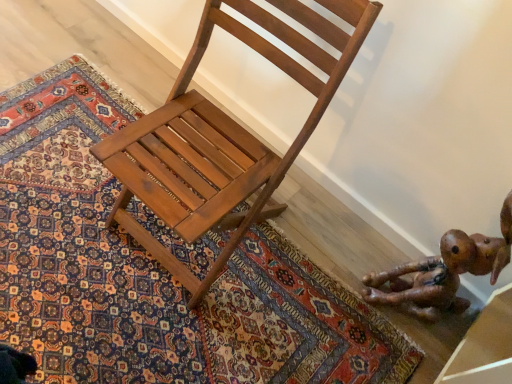
Where is `free space that is to the left of brown leather toy at lower right`? This screenshot has width=512, height=384. free space that is to the left of brown leather toy at lower right is located at coordinates (336, 251).